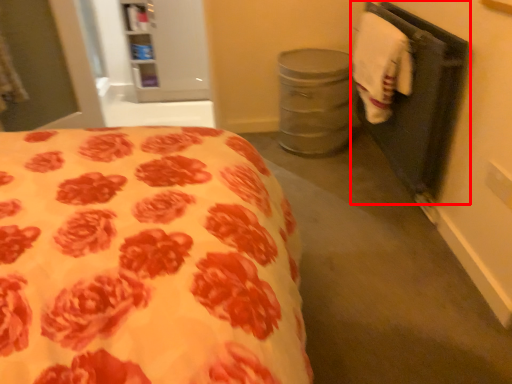
Question: From the image's perspective, what is the correct spatial relationship of closet (annotated by the red box) in relation to hand towel?

Choices:
 (A) above
 (B) below

Answer: (B)